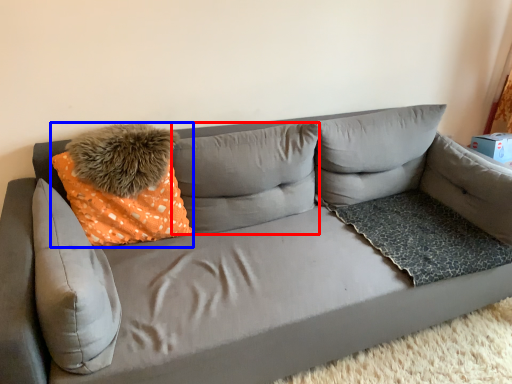
Question: Which object is further to the camera taking this photo, pillow (highlighted by a red box) or throw pillow (highlighted by a blue box)?

Choices:
 (A) pillow
 (B) throw pillow

Answer: (A)